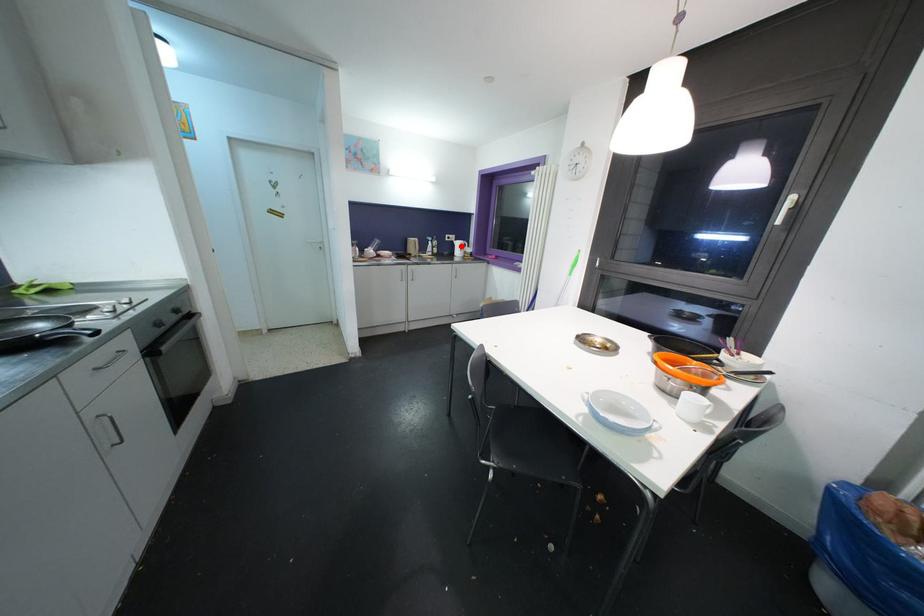
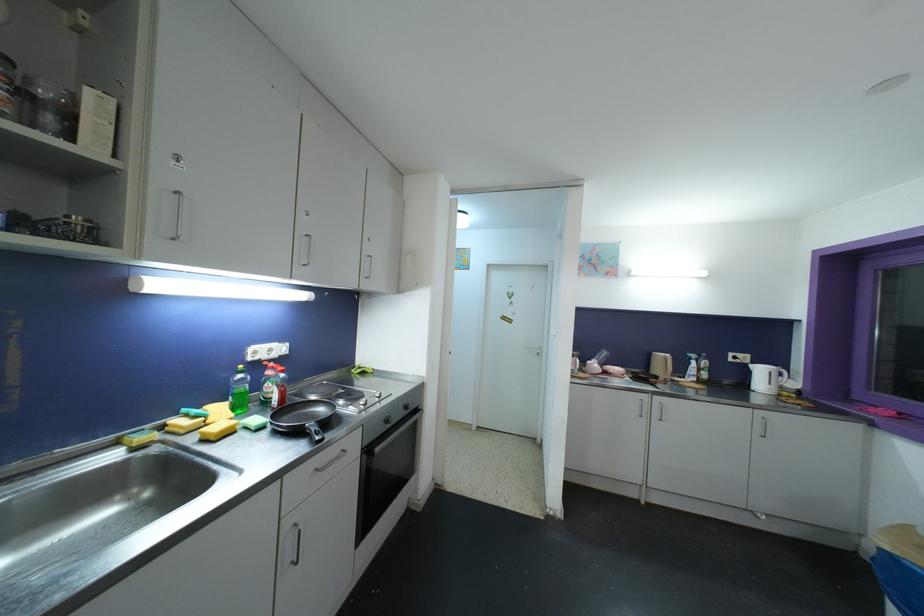
In the second image, find the point that corresponds to the highlighted location in the first image.

(763, 373)